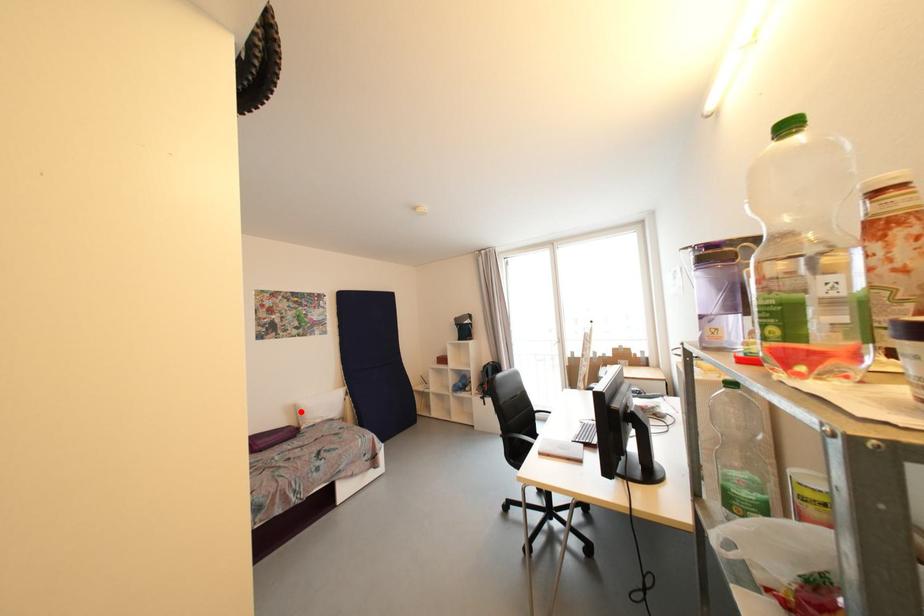
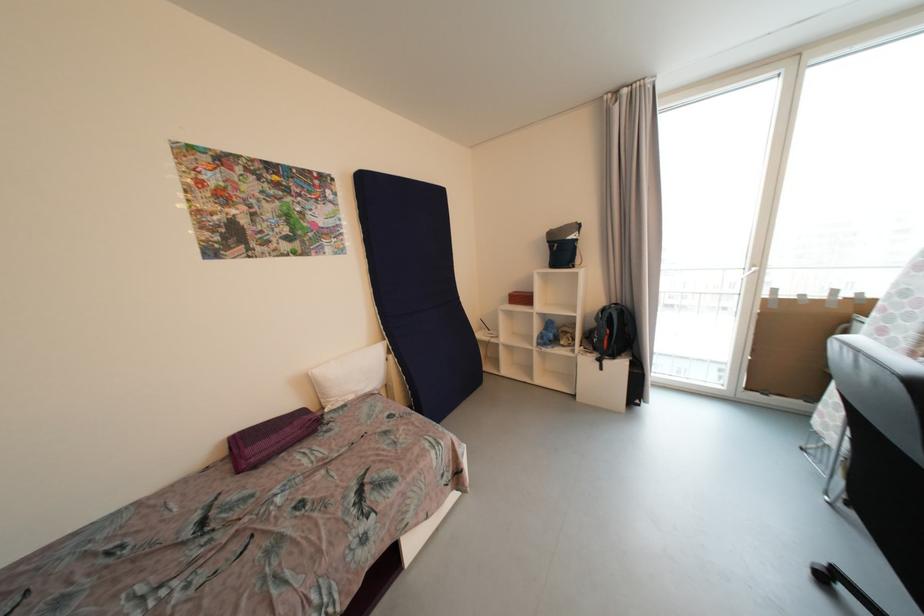
Find the pixel in the second image that matches the highlighted location in the first image.

(315, 386)